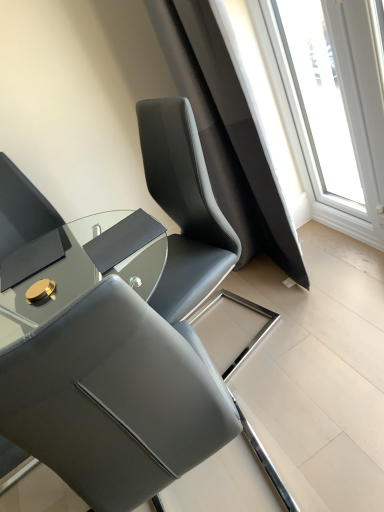
Question: In terms of height, does matte gray chair at center look taller or shorter compared to shiny black glass table at center?

Choices:
 (A) tall
 (B) short

Answer: (A)

Question: Is matte gray chair at center in front of or behind shiny black glass table at center in the image?

Choices:
 (A) front
 (B) behind

Answer: (A)

Question: Estimate the real-world distances between objects in this image. Which object is closer to the matte gray chair at center?

Choices:
 (A) transparent glass window at upper right
 (B) shiny black glass table at center

Answer: (B)

Question: Based on their relative distances, which object is nearer to the matte gray chair at center?

Choices:
 (A) transparent glass window at upper right
 (B) shiny black glass table at center

Answer: (B)